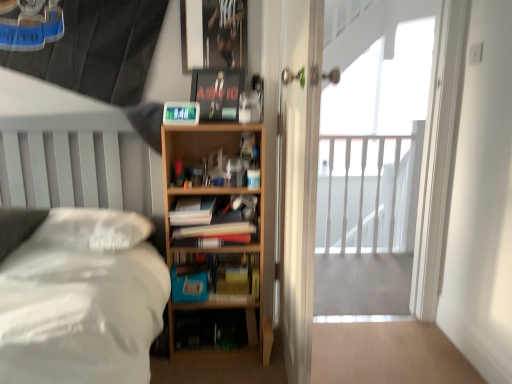
Question: From the image's perspective, is white wooden railing at upper right under matte black paperback book at upper center, the 2th paperback book from the bottom?

Choices:
 (A) no
 (B) yes

Answer: (B)

Question: Considering the relative sizes of white wooden railing at upper right and matte black paperback book at upper center, the 2th paperback book from the bottom, in the image provided, is white wooden railing at upper right bigger than matte black paperback book at upper center, the 2th paperback book from the bottom,?

Choices:
 (A) yes
 (B) no

Answer: (A)

Question: Is white wooden railing at upper right turned away from matte black paperback book at upper center, placed as the first paperback book when sorted from top to bottom?

Choices:
 (A) yes
 (B) no

Answer: (B)

Question: Is white wooden railing at upper right to the left of matte black paperback book at upper center, the 2th paperback book from the bottom, from the viewer's perspective?

Choices:
 (A) yes
 (B) no

Answer: (B)

Question: Is the position of white wooden railing at upper right more distant than that of matte black paperback book at upper center, placed as the first paperback book when sorted from top to bottom?

Choices:
 (A) no
 (B) yes

Answer: (B)

Question: Would you say matte black paperback book at upper center, placed as the first paperback book when sorted from top to bottom, is part of white wooden railing at upper right's contents?

Choices:
 (A) yes
 (B) no

Answer: (B)

Question: Is white wooden railing at upper right shorter than white matte bed at left?

Choices:
 (A) yes
 (B) no

Answer: (B)

Question: From a real-world perspective, is white wooden railing at upper right located beneath white matte bed at left?

Choices:
 (A) no
 (B) yes

Answer: (A)

Question: Can you confirm if white wooden railing at upper right is positioned to the left of white matte bed at left?

Choices:
 (A) yes
 (B) no

Answer: (B)

Question: Is white wooden railing at upper right positioned in front of white matte bed at left?

Choices:
 (A) yes
 (B) no

Answer: (B)

Question: Considering the relative positions of white wooden railing at upper right and white matte bed at left in the image provided, is white wooden railing at upper right to the right of white matte bed at left from the viewer's perspective?

Choices:
 (A) yes
 (B) no

Answer: (A)

Question: Would you consider white wooden railing at upper right to be distant from white matte bed at left?

Choices:
 (A) yes
 (B) no

Answer: (A)

Question: Can you confirm if white wooden railing at upper right is taller than white matte bed at left?

Choices:
 (A) yes
 (B) no

Answer: (A)